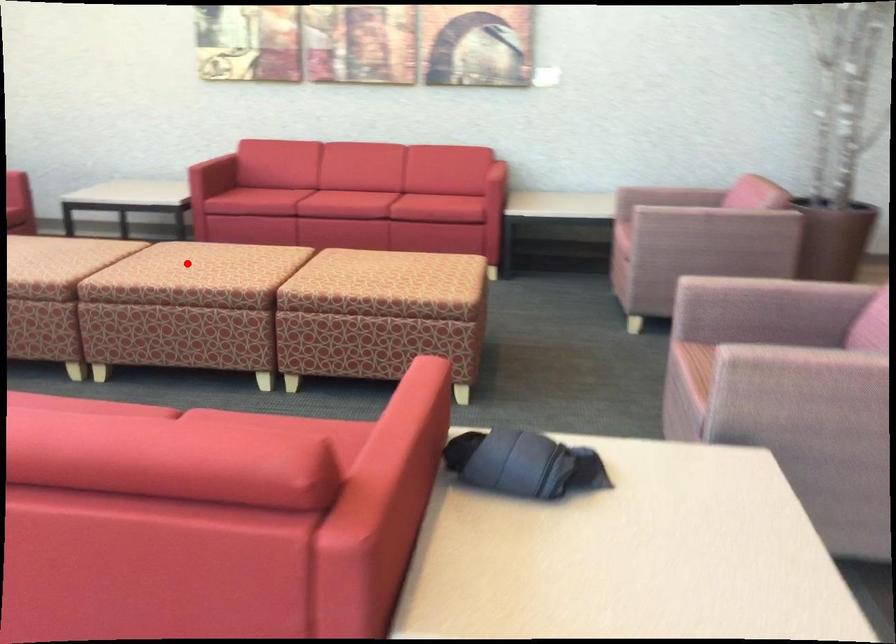
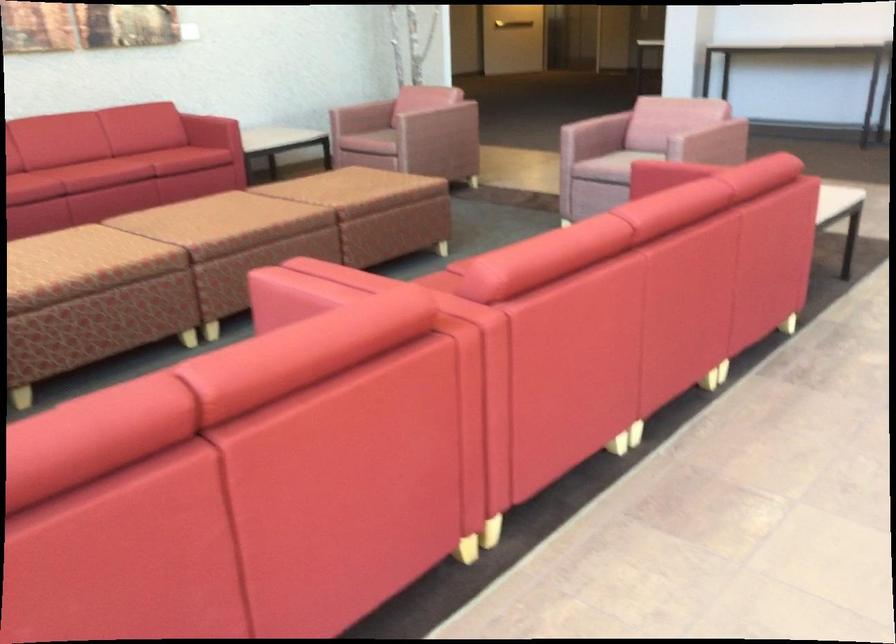
Question: I am providing you with two images of the same scene from different viewpoints. A red point is marked on the first image. At the location where the point appears in image 1, is it still visible in image 2?

Choices:
 (A) Yes
 (B) No

Answer: (B)